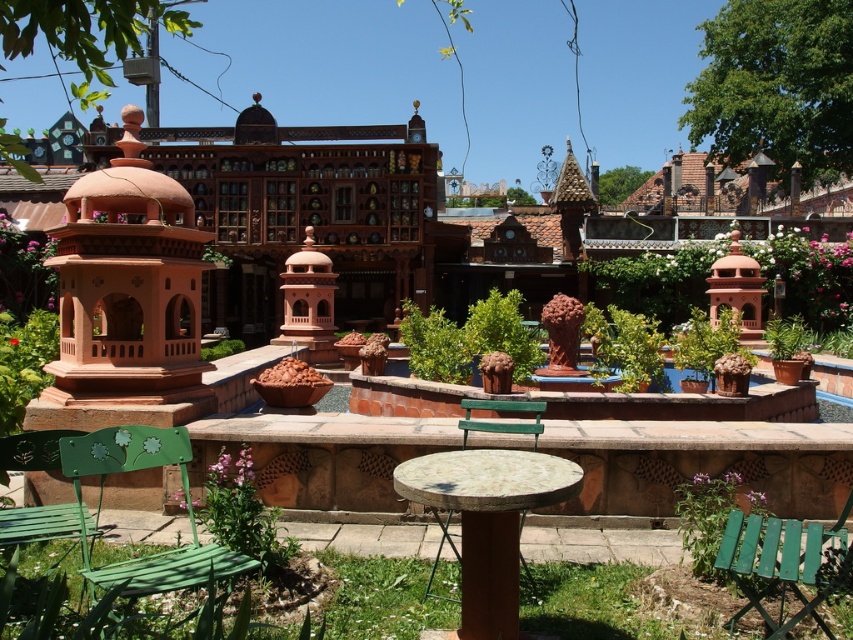
Question: Which of these objects is positioned closest to the green wood bench at center?

Choices:
 (A) terracotta clay gazebo at left
 (B) green metal bench at lower left
 (C) green painted wood bench at lower left
 (D) marble stone table at center

Answer: (D)

Question: Can you confirm if marble stone table at center is wider than green painted wood bench at lower left?

Choices:
 (A) no
 (B) yes

Answer: (B)

Question: Which object appears farthest from the camera in this image?

Choices:
 (A) green metal bench at lower left
 (B) terracotta clay gazebo at left
 (C) green wood chair at lower right
 (D) marble stone table at center

Answer: (B)

Question: Does green metal bench at lower left have a lesser width compared to green wood bench at center?

Choices:
 (A) yes
 (B) no

Answer: (B)

Question: Which point is farther from the camera taking this photo?

Choices:
 (A) (45, 525)
 (B) (144, 440)
 (C) (515, 488)
 (D) (750, 596)

Answer: (B)

Question: Can you confirm if terracotta clay gazebo at left is positioned to the left of green painted wood bench at lower left?

Choices:
 (A) yes
 (B) no

Answer: (A)